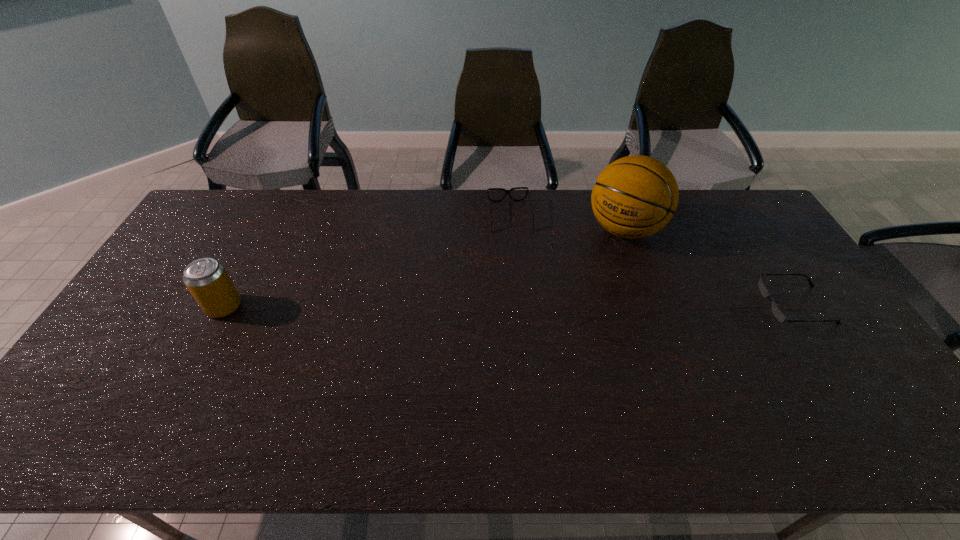
Find the location of a particular element. The height and width of the screenshot is (540, 960). vacant space that is in between the second object from right to left and the second shortest object is located at coordinates (566, 223).

Identify the location of free point between the second object from right to left and the shorter spectacles. (709, 267).

In order to click on vacant area between the taller spectacles and the tallest object in this screenshot , I will do `click(566, 223)`.

Identify the location of free space between the left spectacles and the nearer spectacles. This screenshot has height=540, width=960. (652, 261).

You are a GUI agent. You are given a task and a screenshot of the screen. Output one action in this format:
    pyautogui.click(x=<x>, y=<y>)
    Task: Click on the free point between the shorter spectacles and the leftmost object
    
    Given the screenshot: What is the action you would take?
    pyautogui.click(x=510, y=306)

Select which object appears as the closest to the shortest object. Please provide its 2D coordinates. Your answer should be formatted as a tuple, i.e. [(x, y)], where the tuple contains the x and y coordinates of a point satisfying the conditions above.

[(635, 196)]

This screenshot has width=960, height=540. What are the coordinates of `object that is the closest to the third shortest object` in the screenshot? It's located at (506, 191).

Where is `vacant space that satisfies the following two spatial constraints: 1. on the front side of the third object from left to right; 2. on the left side of the taller spectacles`? This screenshot has width=960, height=540. vacant space that satisfies the following two spatial constraints: 1. on the front side of the third object from left to right; 2. on the left side of the taller spectacles is located at coordinates (511, 230).

I want to click on vacant area in the image that satisfies the following two spatial constraints: 1. on the back side of the third object from right to left; 2. on the left side of the leftmost object, so click(x=272, y=216).

Find the location of `free space that satisfies the following two spatial constraints: 1. on the back side of the shorter spectacles; 2. on the front-facing side of the pop (soda)`. free space that satisfies the following two spatial constraints: 1. on the back side of the shorter spectacles; 2. on the front-facing side of the pop (soda) is located at coordinates [x=225, y=305].